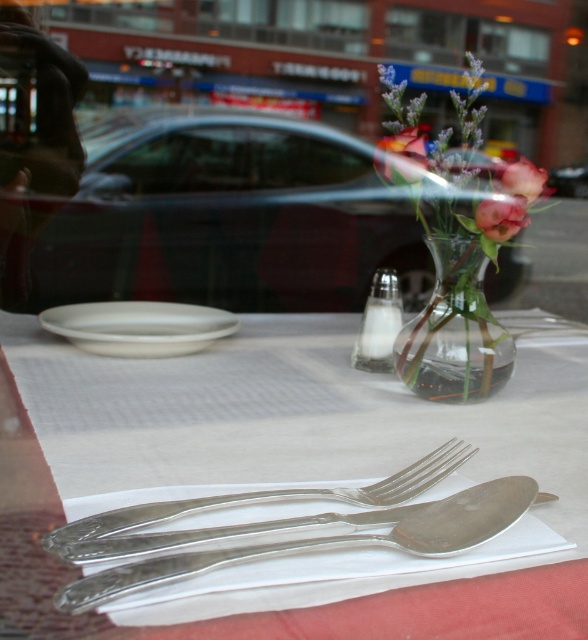
Question: Which is nearer to the silver metallic cutlery at center?

Choices:
 (A) polished silver fork at center
 (B) pink matte flower at center
 (C) white porcelain plate at left

Answer: (C)

Question: Does silver metallic cutlery at center have a smaller size compared to pink floral bouquet at center?

Choices:
 (A) yes
 (B) no

Answer: (B)

Question: Where is white porcelain plate at left located in relation to pink matte flower at upper center in the image?

Choices:
 (A) below
 (B) above

Answer: (A)

Question: Which of these objects is positioned closest to the polished silver spoon at center?

Choices:
 (A) pink floral bouquet at center
 (B) pink matte flower at upper center

Answer: (B)

Question: Can you confirm if silver metallic cutlery at center is positioned above pink matte flower at upper center?

Choices:
 (A) no
 (B) yes

Answer: (A)

Question: Which point is closer to the camera taking this photo?

Choices:
 (A) (102, 547)
 (B) (182, 323)
 (C) (422, 173)

Answer: (A)